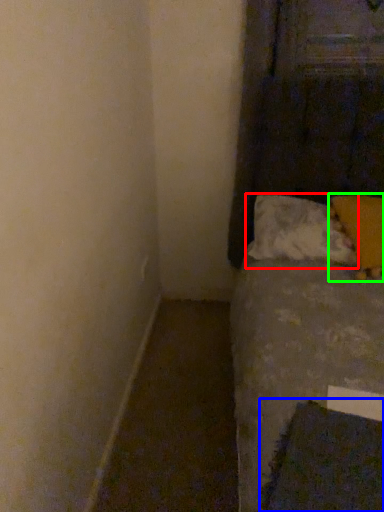
Question: Which object is positioned closest to pillow (highlighted by a red box)? Select from sheet (highlighted by a blue box) and pillow (highlighted by a green box).

Choices:
 (A) sheet
 (B) pillow

Answer: (B)